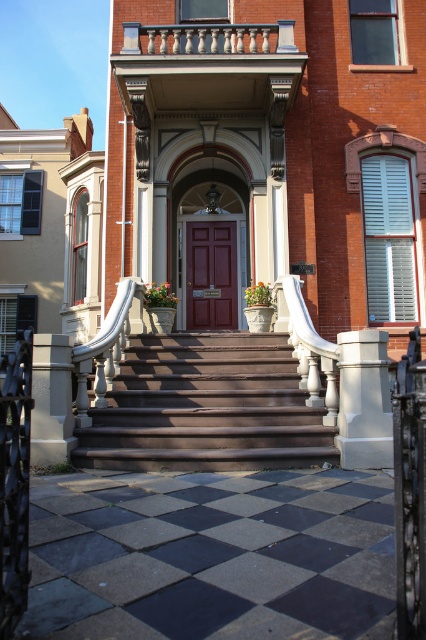
You are standing at the bottom of the brown polished wood stairs at center and want to reach the front door. Which direction should you move to avoid the white stone pillar at lower left?

Since the brown polished wood stairs at center are positioned under the white stone pillar at lower left, you should move to the right to avoid the white stone pillar at lower left and head towards the front door.

You are a delivery person trying to reach the front door of the Victorian house. You need to know which object is shorter between the brown polished wood stairs at center and the white stone pillar at lower left to decide your path. Which one is shorter?

The brown polished wood stairs at center is not as tall as the white stone pillar at lower left, so the stairs are shorter.